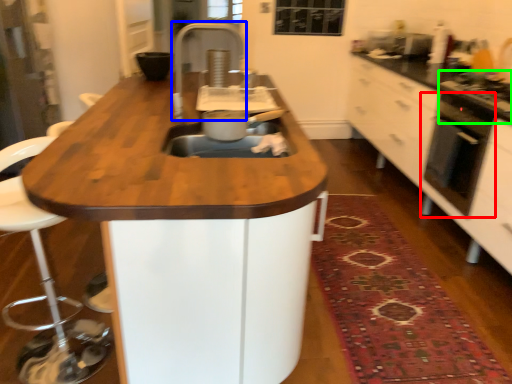
Question: Based on their relative distances, which object is nearer to home appliance (highlighted by a red box)? Choose from faucet (highlighted by a blue box) and gas stove (highlighted by a green box).

Choices:
 (A) faucet
 (B) gas stove

Answer: (B)